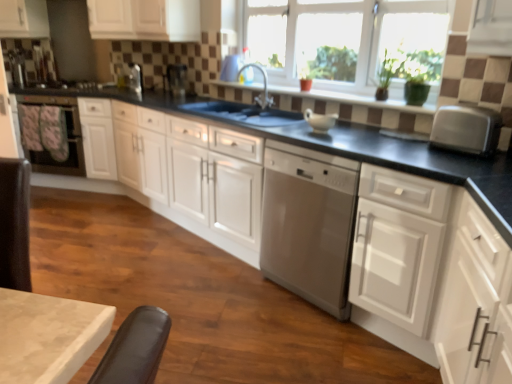
Where is `vacant space behind satin silver toaster at upper center, the second appliance in the right-to-left sequence`? vacant space behind satin silver toaster at upper center, the second appliance in the right-to-left sequence is located at coordinates (139, 92).